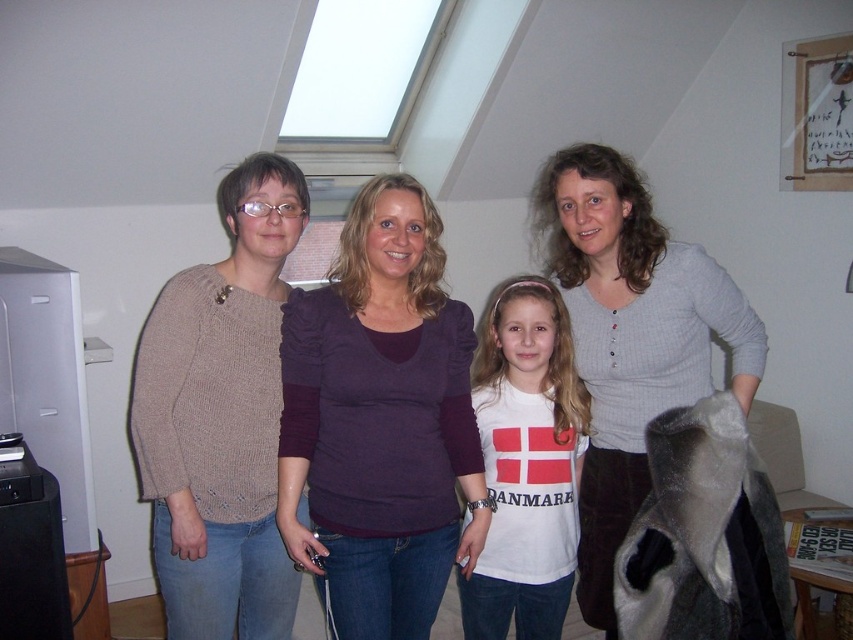
Can you confirm if knitted beige sweater at left is positioned above gray textured sweater at center?

No.

Is point (245, 284) less distant than point (619, 288)?

Yes, it is in front of point (619, 288).

Which is in front, point (161, 525) or point (599, 397)?

Point (161, 525)

Identify the location of knitted beige sweater at left. The height and width of the screenshot is (640, 853). (221, 417).

Is matte purple sweater at center smaller than white cotton shirt at center?

Actually, matte purple sweater at center might be larger than white cotton shirt at center.

Who is more forward, (671, 372) or (509, 468)?

Point (509, 468) is in front.

Who is more forward, (547, 273) or (497, 474)?

Point (497, 474)

I want to click on matte purple sweater at center, so click(631, 333).

Between purple soft fabric shirt at center and gray textured sweater at center, which one has more height?

gray textured sweater at center

Is point (415, 212) positioned after point (631, 426)?

No, (415, 212) is in front of (631, 426).

In order to click on purple soft fabric shirt at center in this screenshot , I will do `click(380, 420)`.